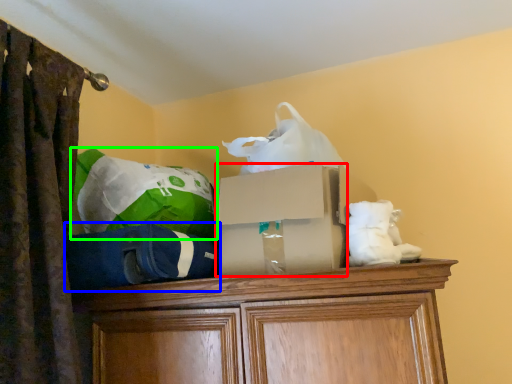
Question: Estimate the real-world distances between objects in this image. Which object is closer to storage box (highlighted by a red box), bean bag chair (highlighted by a blue box) or bean bag chair (highlighted by a green box)?

Choices:
 (A) bean bag chair
 (B) bean bag chair

Answer: (A)